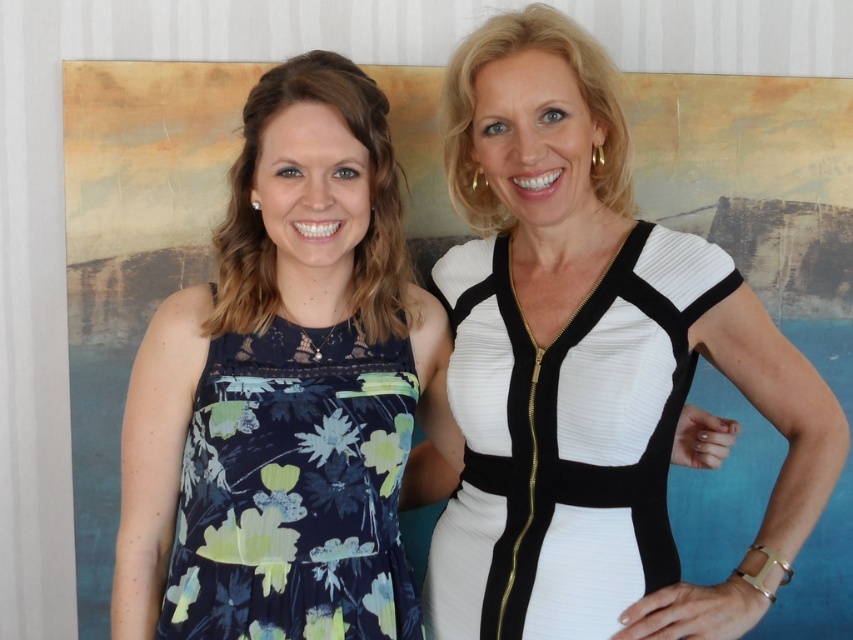
Two women are standing together in front of an abstract painting. They are wearing a white matte dress at center and another outfit. How far apart are they?

The two women are 1.34 meters apart.